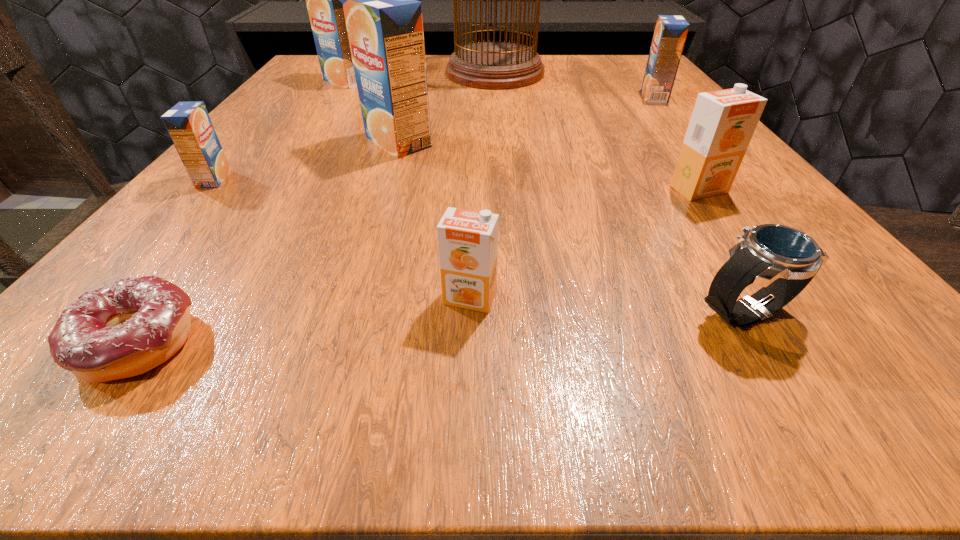
At what (x,y) coordinates should I click in order to perform the action: click on vacant space positioned on the front of the third smallest blue orange_juice. Please return your answer as a coordinate pair (x, y). This screenshot has width=960, height=540. Looking at the image, I should click on (331, 103).

Identify the location of blank space located on the front of the seventh nearest object. This screenshot has height=540, width=960. (685, 135).

Locate an element on the screen. free spot located on the left of the bigger orange orange juice is located at coordinates (522, 190).

You are a GUI agent. You are given a task and a screenshot of the screen. Output one action in this format:
    pyautogui.click(x=<x>, y=<y>)
    Task: Click on the blank space located 0.130m on the front of the leftmost orange juice
    
    Given the screenshot: What is the action you would take?
    pyautogui.click(x=157, y=242)

Where is `vacant space positioned 0.070m on the right of the fourth orange juice from left to right`? vacant space positioned 0.070m on the right of the fourth orange juice from left to right is located at coordinates (561, 298).

Where is `free space located 0.360m on the back of the silver watch`? This screenshot has width=960, height=540. free space located 0.360m on the back of the silver watch is located at coordinates (642, 144).

You are a GUI agent. You are given a task and a screenshot of the screen. Output one action in this format:
    pyautogui.click(x=<x>, y=<y>)
    Task: Click on the vacant space positioned 0.280m on the back of the doughnut
    This screenshot has width=960, height=540.
    Given the screenshot: What is the action you would take?
    pyautogui.click(x=262, y=174)

Find the location of `birdcage at the far edge`. birdcage at the far edge is located at coordinates (493, 65).

Where is `orange_juice located at the far edge`? The height and width of the screenshot is (540, 960). orange_juice located at the far edge is located at coordinates (324, 0).

I want to click on watch at the near edge, so click(x=783, y=260).